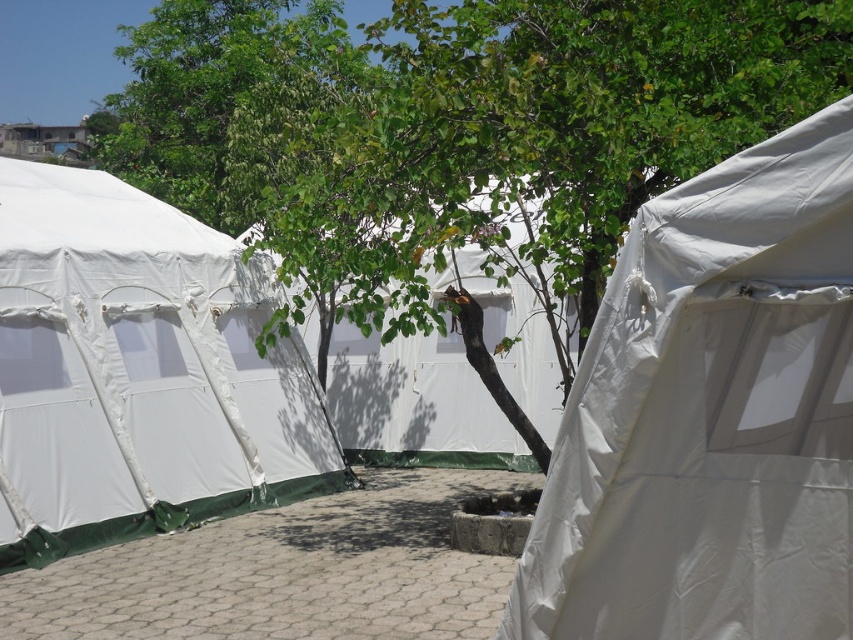
Question: Which of the following is the farthest from the observer?

Choices:
 (A) (369, 140)
 (B) (583, 516)
 (C) (102, 268)

Answer: (C)

Question: Is white fabric tent at left closer to camera compared to white fabric canopy at center?

Choices:
 (A) no
 (B) yes

Answer: (B)

Question: Does green leafy tree at center appear on the right side of white fabric tent at left?

Choices:
 (A) no
 (B) yes

Answer: (B)

Question: Which of the following is the closest to the observer?

Choices:
 (A) white fabric canopy at center
 (B) white fabric tent at left

Answer: (B)

Question: Among these objects, which one is farthest from the camera?

Choices:
 (A) white matte tent at center
 (B) white fabric canopy at center

Answer: (B)

Question: Can you confirm if white matte tent at center is smaller than green leafy tree at center?

Choices:
 (A) yes
 (B) no

Answer: (A)